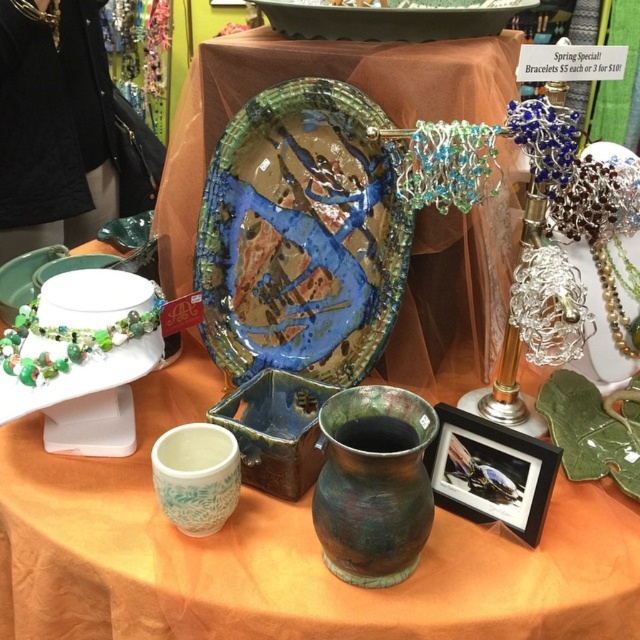
Who is higher up, green glazed mug at center or green matte plate at center?

green matte plate at center

Does point (184, 428) lie in front of point (49, 262)?

Yes, point (184, 428) is closer to viewer.

The height and width of the screenshot is (640, 640). What are the coordinates of `green glazed mug at center` in the screenshot? It's located at (196, 476).

Can you confirm if glazed ceramic platter at center is shorter than green matte vase at center?

Incorrect, glazed ceramic platter at center's height does not fall short of green matte vase at center's.

Between glazed ceramic platter at center and green matte vase at center, which one appears on the right side from the viewer's perspective?

Positioned to the right is green matte vase at center.

Who is more distant from viewer, (x=378, y=348) or (x=328, y=522)?

The point (x=378, y=348) is behind.

I want to click on glazed ceramic platter at center, so click(301, 236).

Between glazed ceramic platter at center and green glazed platter at upper center, which one is positioned lower?

Positioned lower is glazed ceramic platter at center.

Is point (365, 328) behind point (365, 22)?

Yes, it is.

Where is `glazed ceramic platter at center`? The height and width of the screenshot is (640, 640). glazed ceramic platter at center is located at coordinates (301, 236).